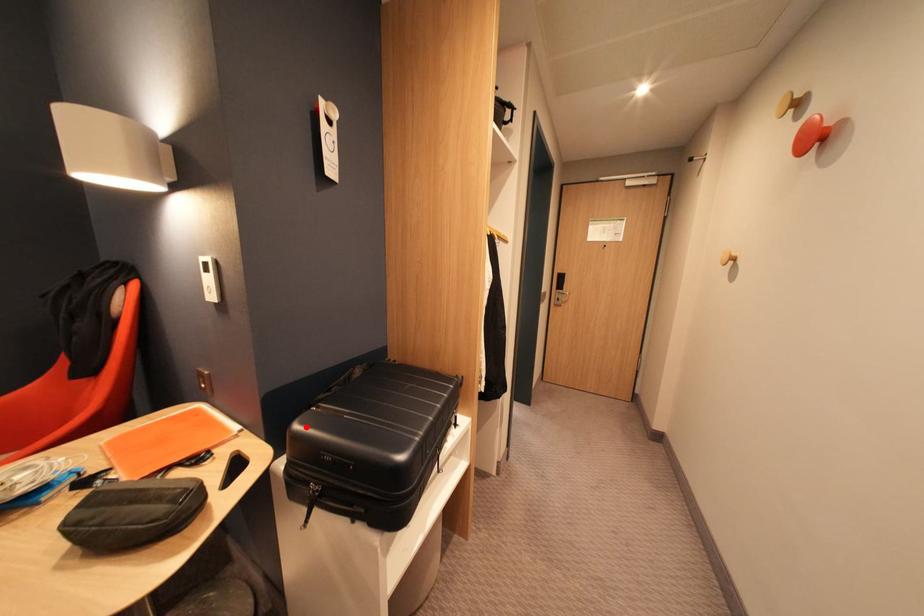
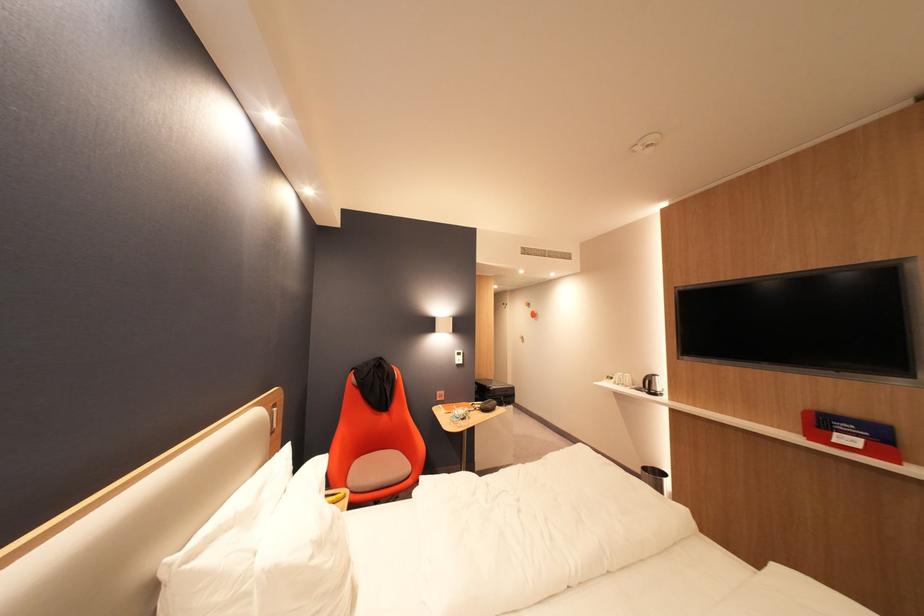
In the second image, find the point that corresponds to the highlighted location in the first image.

(502, 390)